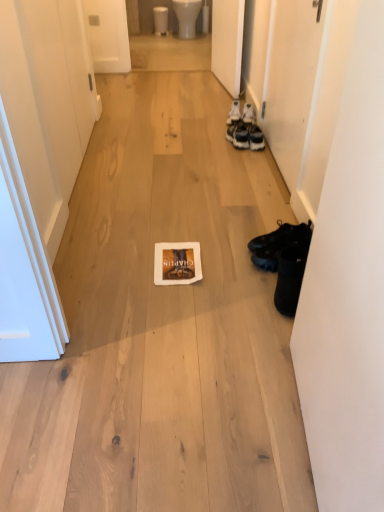
What are the coordinates of `vacant space to the left of black leather shoes at lower right, which is the first footwear from front to back` in the screenshot? It's located at (237, 292).